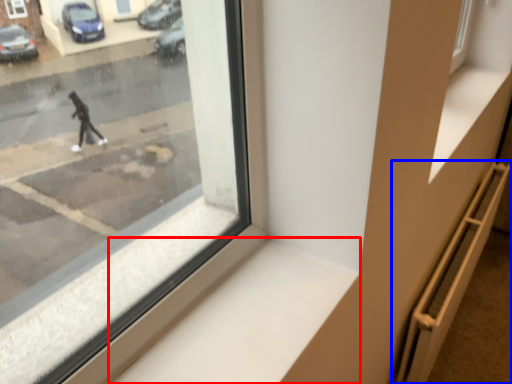
Question: Among these objects, which one is farthest to the camera, window sill (highlighted by a red box) or stairwell (highlighted by a blue box)?

Choices:
 (A) window sill
 (B) stairwell

Answer: (B)